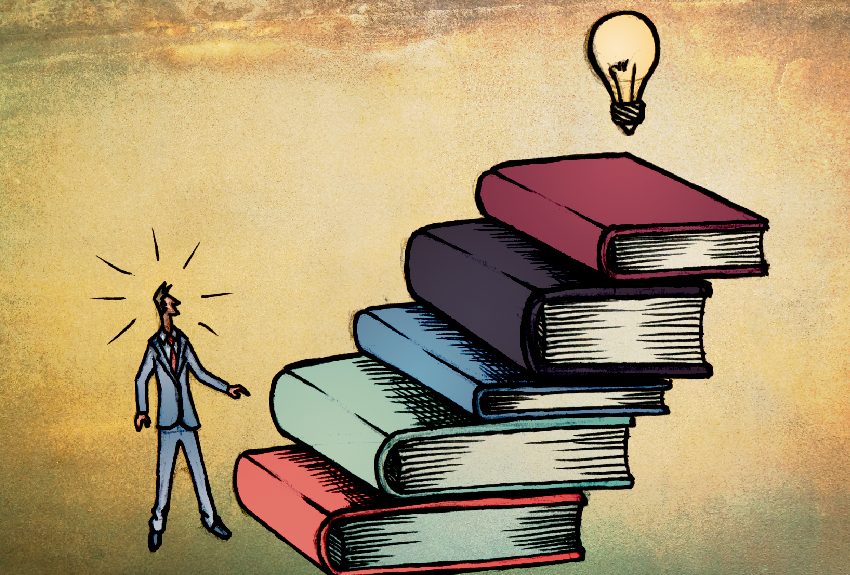
Locate an element on the screen. illustrated books in a stack forming a set of stairs is located at coordinates coord(267,489), coord(348,423), coord(423,361), coord(484,305), coord(562,217).